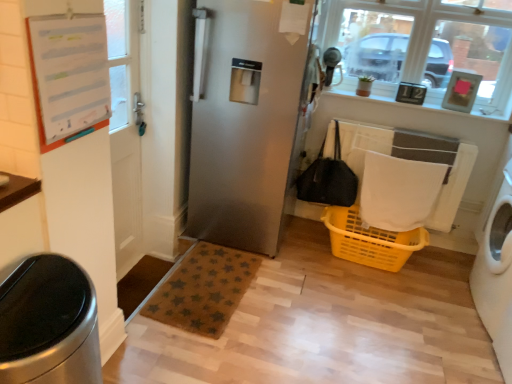
Question: Considering the relative sizes of white paper at upper left and clear glass window at upper right in the image provided, is white paper at upper left thinner than clear glass window at upper right?

Choices:
 (A) no
 (B) yes

Answer: (B)

Question: Is white paper at upper left shorter than clear glass window at upper right?

Choices:
 (A) yes
 (B) no

Answer: (A)

Question: Considering the relative sizes of white paper at upper left and clear glass window at upper right in the image provided, is white paper at upper left smaller than clear glass window at upper right?

Choices:
 (A) yes
 (B) no

Answer: (A)

Question: From a real-world perspective, is white paper at upper left positioned under clear glass window at upper right based on gravity?

Choices:
 (A) yes
 (B) no

Answer: (A)

Question: From the image's perspective, is white paper at upper left located above clear glass window at upper right?

Choices:
 (A) yes
 (B) no

Answer: (B)

Question: Considering the relative positions of satin silver refrigerator at center and black fabric bag at center in the image provided, is satin silver refrigerator at center to the left or to the right of black fabric bag at center?

Choices:
 (A) left
 (B) right

Answer: (A)

Question: From a real-world perspective, is satin silver refrigerator at center above or below black fabric bag at center?

Choices:
 (A) above
 (B) below

Answer: (A)

Question: From the image's perspective, is satin silver refrigerator at center above or below black fabric bag at center?

Choices:
 (A) above
 (B) below

Answer: (A)

Question: In terms of width, does satin silver refrigerator at center look wider or thinner when compared to black fabric bag at center?

Choices:
 (A) thin
 (B) wide

Answer: (B)

Question: Looking at their shapes, would you say clear glass window at upper right is wider or thinner than white paper at upper left?

Choices:
 (A) wide
 (B) thin

Answer: (A)

Question: Is clear glass window at upper right bigger or smaller than white paper at upper left?

Choices:
 (A) small
 (B) big

Answer: (B)

Question: From a real-world perspective, is clear glass window at upper right physically located above or below white paper at upper left?

Choices:
 (A) above
 (B) below

Answer: (A)

Question: In the image, is clear glass window at upper right on the left side or the right side of white paper at upper left?

Choices:
 (A) left
 (B) right

Answer: (B)

Question: From the image's perspective, relative to satin silver refrigerator at center, is black fabric bag at center above or below?

Choices:
 (A) above
 (B) below

Answer: (B)

Question: Looking at their shapes, would you say black fabric bag at center is wider or thinner than satin silver refrigerator at center?

Choices:
 (A) thin
 (B) wide

Answer: (A)